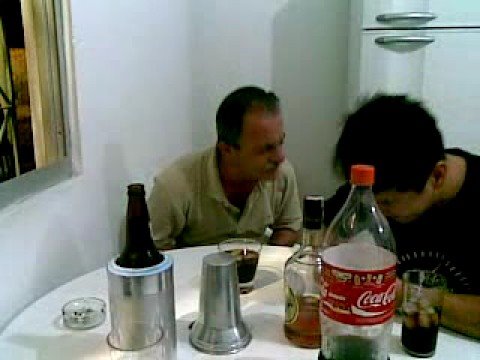
The height and width of the screenshot is (360, 480). Identify the location of bottle chiller. (157, 286), (217, 302).